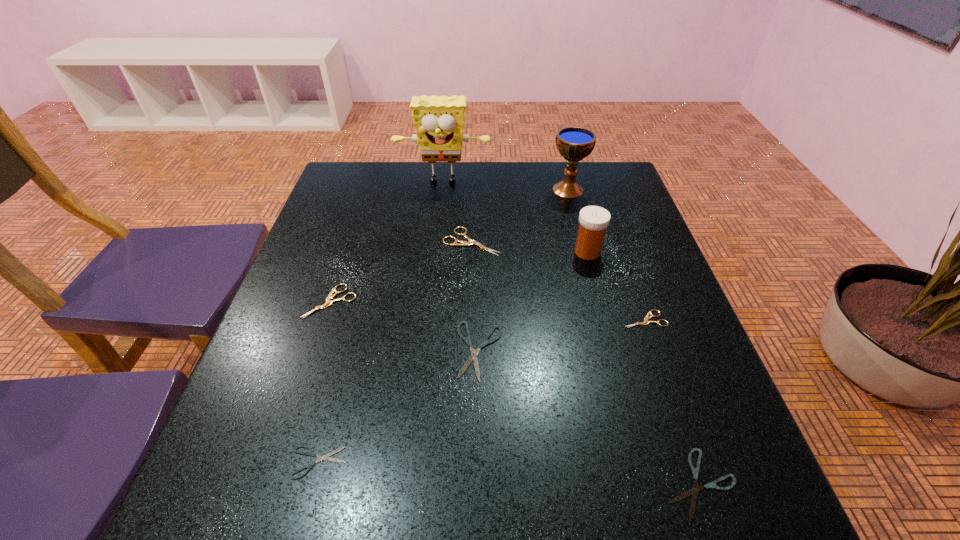
What are the coordinates of `yellow sponge` in the screenshot? It's located at [x=439, y=121].

Locate an element on the screen. Image resolution: width=960 pixels, height=540 pixels. sponge is located at coordinates (439, 121).

Identify the location of blue chalice. This screenshot has width=960, height=540. (574, 143).

This screenshot has width=960, height=540. I want to click on chalice, so click(x=574, y=143).

Where is `white medicine`? white medicine is located at coordinates (593, 220).

This screenshot has width=960, height=540. Find the location of `the seventh shortest object`. the seventh shortest object is located at coordinates (593, 220).

Where is `the biggest beige shears`? The height and width of the screenshot is (540, 960). the biggest beige shears is located at coordinates (457, 242).

In order to click on the farthest beige shears in this screenshot , I will do `click(457, 242)`.

The height and width of the screenshot is (540, 960). What are the coordinates of `the fifth shortest object` in the screenshot? It's located at (328, 302).

Where is `the second biggest beige shears`? The image size is (960, 540). the second biggest beige shears is located at coordinates (328, 302).